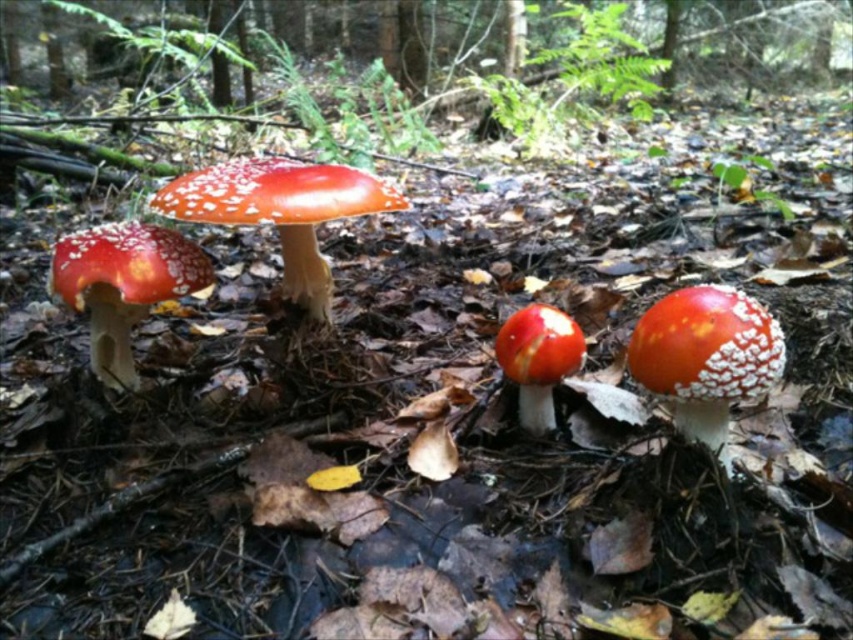
Is point (386, 195) in front of point (65, 250)?

No, it is not.

From the picture: Can you confirm if shiny red mushroom at center is shorter than matte red mushroom at left?

Incorrect, shiny red mushroom at center's height does not fall short of matte red mushroom at left's.

The image size is (853, 640). I want to click on shiny red mushroom at center, so click(x=281, y=211).

Can you confirm if smooth red mushroom at center is taller than smooth white mushroom at center?

Indeed, smooth red mushroom at center has a greater height compared to smooth white mushroom at center.

Is smooth red mushroom at center thinner than smooth white mushroom at center?

No, smooth red mushroom at center is not thinner than smooth white mushroom at center.

The width and height of the screenshot is (853, 640). What do you see at coordinates (706, 356) in the screenshot?
I see `smooth red mushroom at center` at bounding box center [706, 356].

Locate an element on the screen. This screenshot has width=853, height=640. smooth red mushroom at center is located at coordinates (706, 356).

Is point (173, 266) farther from viewer compared to point (550, 426)?

Yes.

Does matte red mushroom at left have a lesser height compared to smooth white mushroom at center?

No, matte red mushroom at left is not shorter than smooth white mushroom at center.

Is point (134, 385) positioned behind point (552, 404)?

Yes, it is.

Where is `matte red mushroom at left`? matte red mushroom at left is located at coordinates (123, 284).